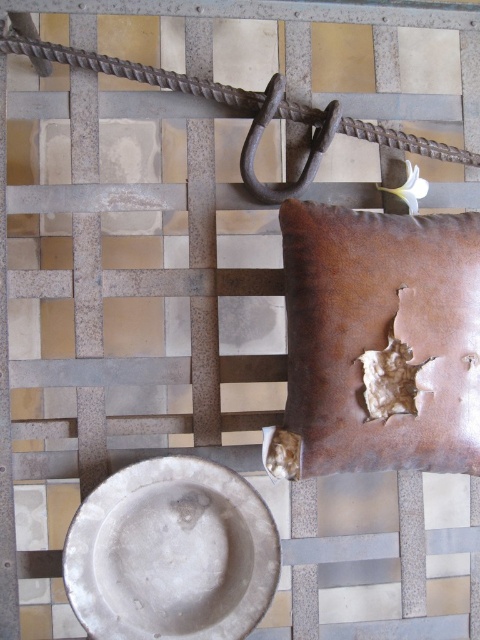
Question: Can you confirm if leather pillow at center is thinner than matte silver plate at center?

Choices:
 (A) yes
 (B) no

Answer: (A)

Question: Which object is farther from the camera taking this photo?

Choices:
 (A) rusty metal rope at upper center
 (B) matte silver plate at center
 (C) leather pillow at center

Answer: (A)

Question: Which of these objects is positioned closest to the leather pillow at center?

Choices:
 (A) matte silver plate at center
 (B) rusty metal hook at center

Answer: (A)

Question: Where is leather pillow at center located in relation to rusty metal hook at center in the image?

Choices:
 (A) below
 (B) above

Answer: (A)

Question: Is leather pillow at center to the right of matte silver plate at center from the viewer's perspective?

Choices:
 (A) no
 (B) yes

Answer: (B)

Question: Which of the following is the farthest from the observer?

Choices:
 (A) rusty metal rope at upper center
 (B) matte silver plate at center

Answer: (A)